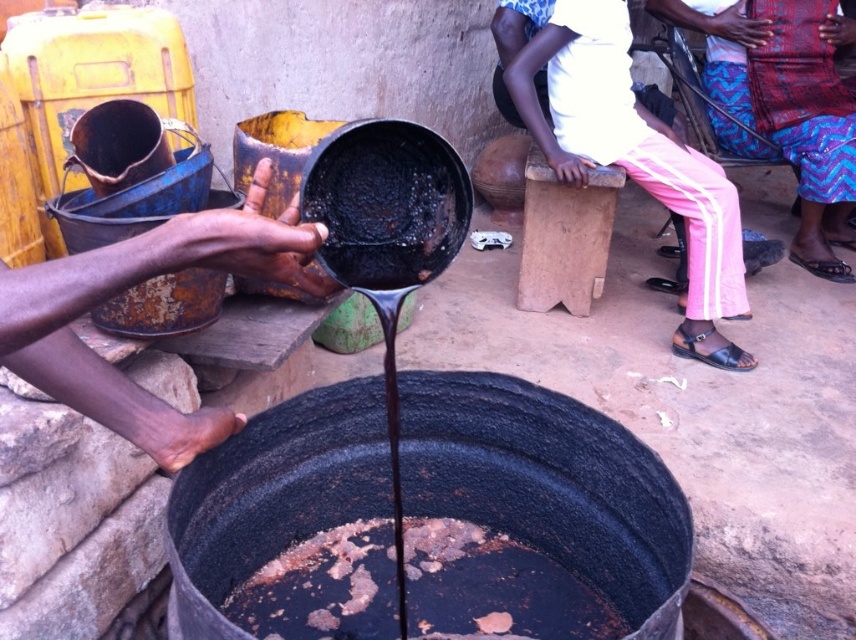
Question: Which of the following is the closest to the observer?

Choices:
 (A) (302, 129)
 (B) (372, 205)
 (C) (720, 19)

Answer: (B)

Question: Estimate the real-world distances between objects in this image. Which object is closer to the rusty metal pot at center?

Choices:
 (A) black matte pot at center
 (B) blue-patterned fabric at center

Answer: (A)

Question: Is black matte pot at center closer to the viewer compared to rusty metal pot at center?

Choices:
 (A) yes
 (B) no

Answer: (A)

Question: Which object appears farthest from the camera in this image?

Choices:
 (A) rusty metal pot at center
 (B) blue-patterned fabric at center

Answer: (B)

Question: Can you confirm if blue-patterned fabric at center is wider than black matte pot at center?

Choices:
 (A) yes
 (B) no

Answer: (A)

Question: Is blue-patterned fabric at center in front of black matte pot at center?

Choices:
 (A) no
 (B) yes

Answer: (A)